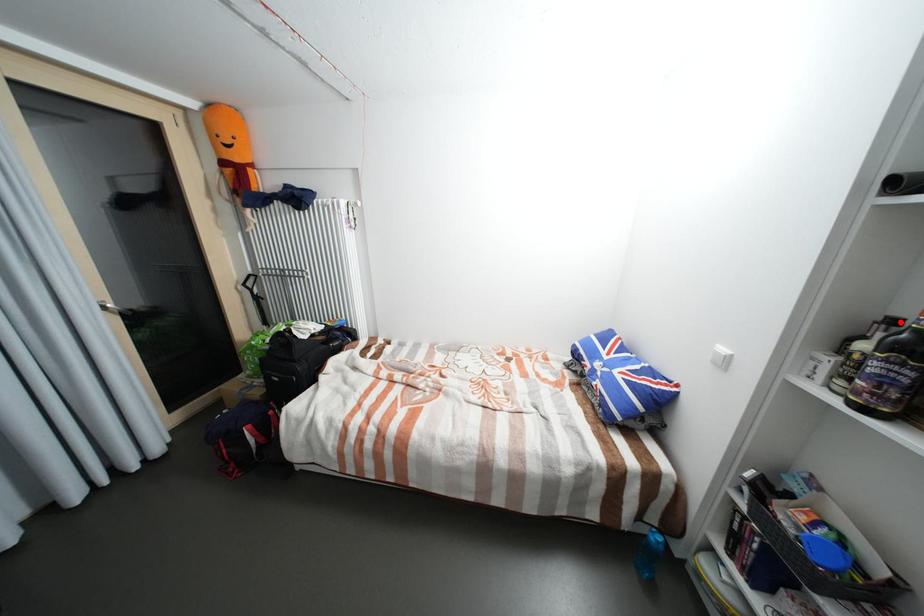
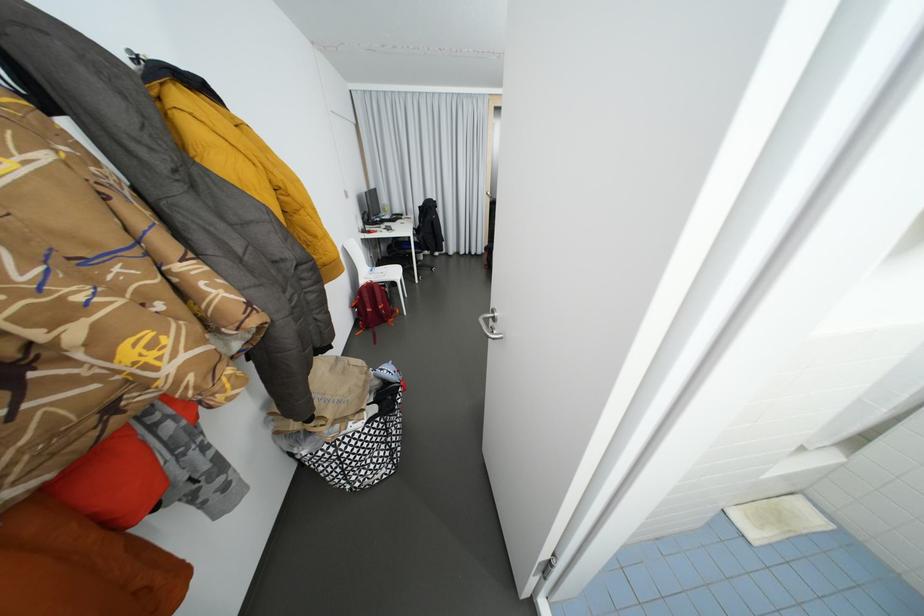
Question: I am providing you with two images of the same scene from different viewpoints. A red point is marked on the first image. Is the red point's position out of view in image 2?

Choices:
 (A) Yes
 (B) No

Answer: (A)